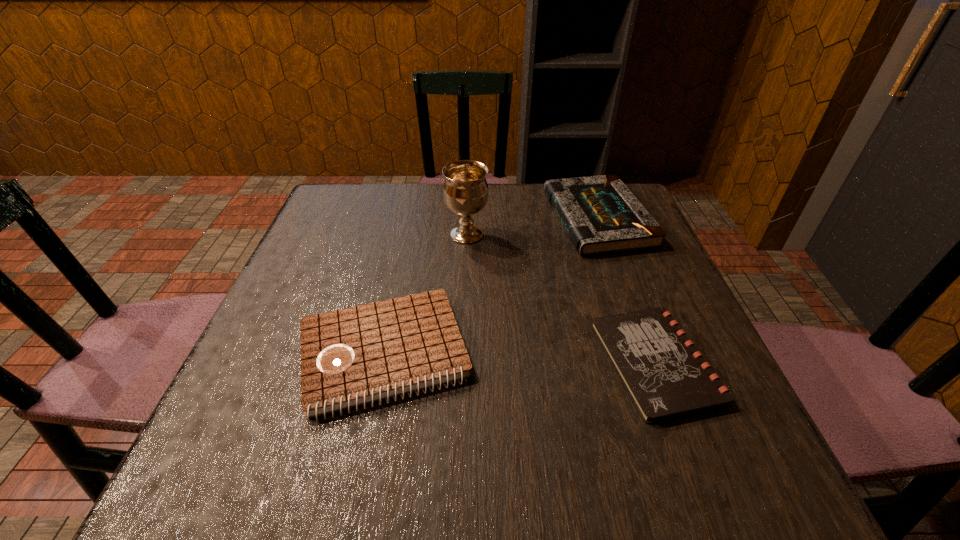
Where is `chalice that is at the far edge`? chalice that is at the far edge is located at coordinates (465, 191).

You are a GUI agent. You are given a task and a screenshot of the screen. Output one action in this format:
    pyautogui.click(x=<x>, y=<y>)
    Task: Click on the notebook situated at the far edge
    
    Given the screenshot: What is the action you would take?
    pyautogui.click(x=601, y=215)

What are the coordinates of `object that is positioned at the left edge` in the screenshot? It's located at (353, 356).

Find the location of a particular element. object present at the far right corner is located at coordinates (601, 215).

The image size is (960, 540). In the image, there is a desktop. In order to click on vacant space at the far edge in this screenshot , I will do `click(525, 214)`.

In the image, there is a desktop. Where is `blank space at the near edge`? The width and height of the screenshot is (960, 540). blank space at the near edge is located at coordinates (603, 463).

Locate an element on the screen. The image size is (960, 540). vacant space at the left edge is located at coordinates (336, 273).

You are a GUI agent. You are given a task and a screenshot of the screen. Output one action in this format:
    pyautogui.click(x=<x>, y=<y>)
    Task: Click on the free space at the right edge of the desktop
    This screenshot has width=960, height=540.
    Given the screenshot: What is the action you would take?
    pyautogui.click(x=701, y=426)

Find the location of a particular element. The width and height of the screenshot is (960, 540). vacant space at the far left corner of the desktop is located at coordinates (359, 190).

This screenshot has width=960, height=540. Identify the location of vacant point located between the farthest notebook and the chalice. (532, 227).